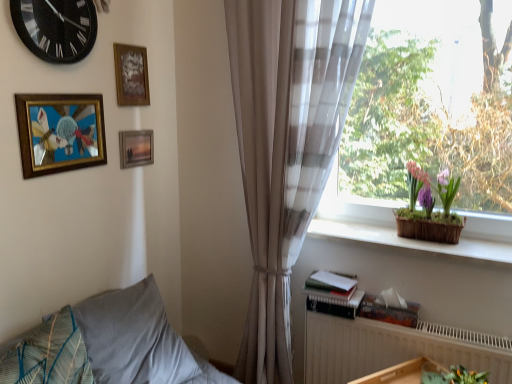
Image resolution: width=512 pixels, height=384 pixels. What are the coordinates of `vacant region above wooden basket at right (from a real-world perspective)` in the screenshot? It's located at (419, 240).